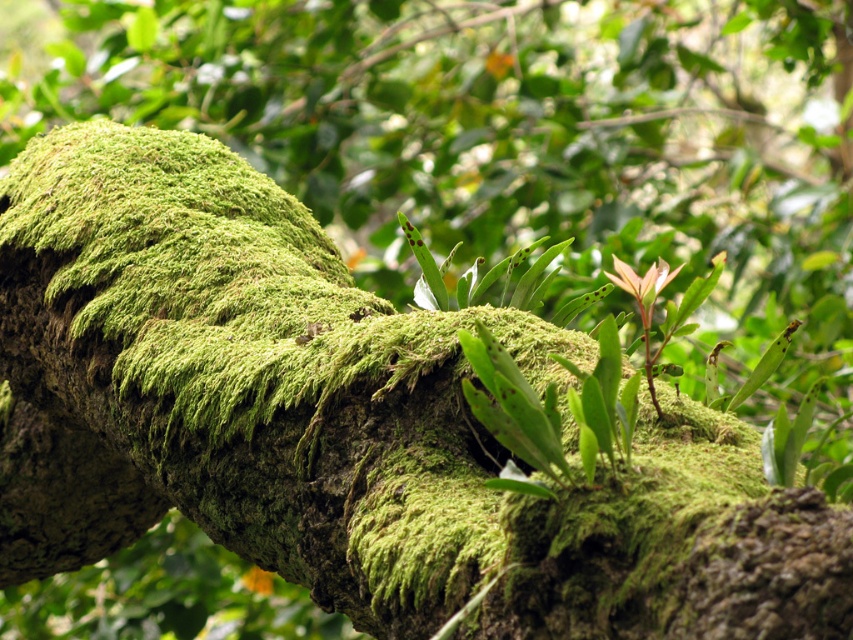
Is green leafy plant at center below green mossy branch at center?

Actually, green leafy plant at center is above green mossy branch at center.

Between green leafy plant at center and green mossy branch at center, which one appears on the right side from the viewer's perspective?

green leafy plant at center is more to the right.

Describe the element at coordinates (642, 280) in the screenshot. The height and width of the screenshot is (640, 853). I see `green leafy plant at center` at that location.

At what (x,y) coordinates should I click in order to perform the action: click on green leafy plant at center. Please return your answer as a coordinate pair (x, y). Looking at the image, I should click on [642, 280].